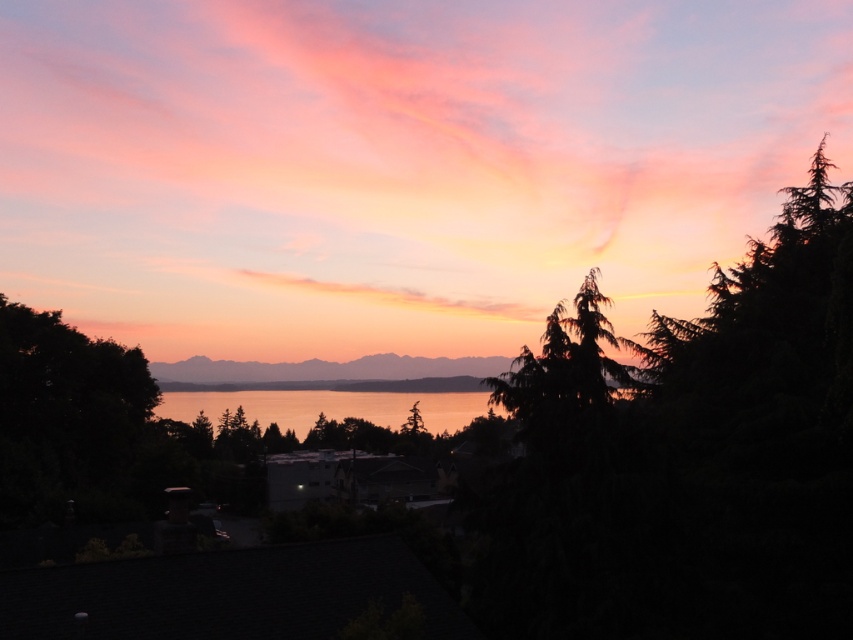
Based on the photo, you are standing in the sunset scene and want to take a photo. You have two points marked in the image. The first point is at coordinates point (x=556, y=310) and the second point is at point (x=329, y=404). Which point is closer to your current position?

Point (x=556, y=310) is closer to the camera than point (x=329, y=404), so the first point is closer to your current position.

You are an artist trying to paint the sunset scene. You notice the green textured pine tree at center and the golden reflective water at center. Which object should you paint first if you want to follow the rule of painting smaller objects before larger ones?

The green textured pine tree at center should be painted first because it has a lesser height compared to the golden reflective water at center, making it smaller.

You are a photographer trying to capture the sunset scene. You want to ensure that the green textured pine tree at center and the golden reflective water at center are both visible in your shot. Based on their widths, which object should you prioritize framing closer to the edge of the photo?

The green textured pine tree at center has a lesser width compared to the golden reflective water at center, so you should prioritize framing the green textured pine tree at center closer to the edge to ensure both fit within the photo.